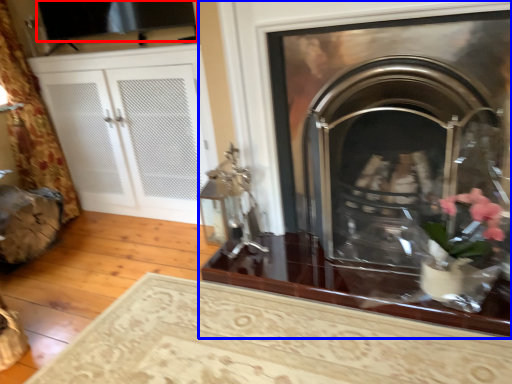
Question: Which of the following is the closest to the observer, window screen (highlighted by a red box) or fireplace (highlighted by a blue box)?

Choices:
 (A) window screen
 (B) fireplace

Answer: (B)